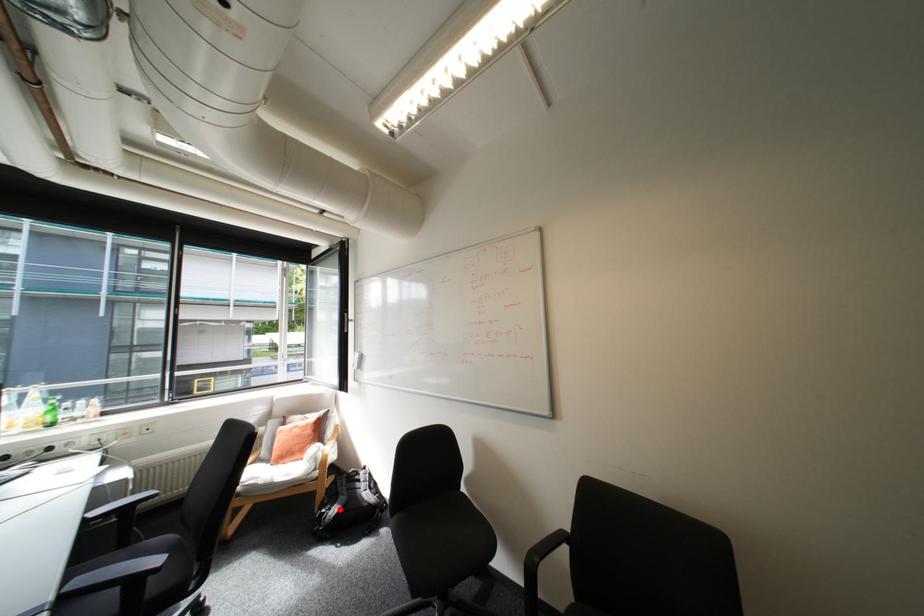
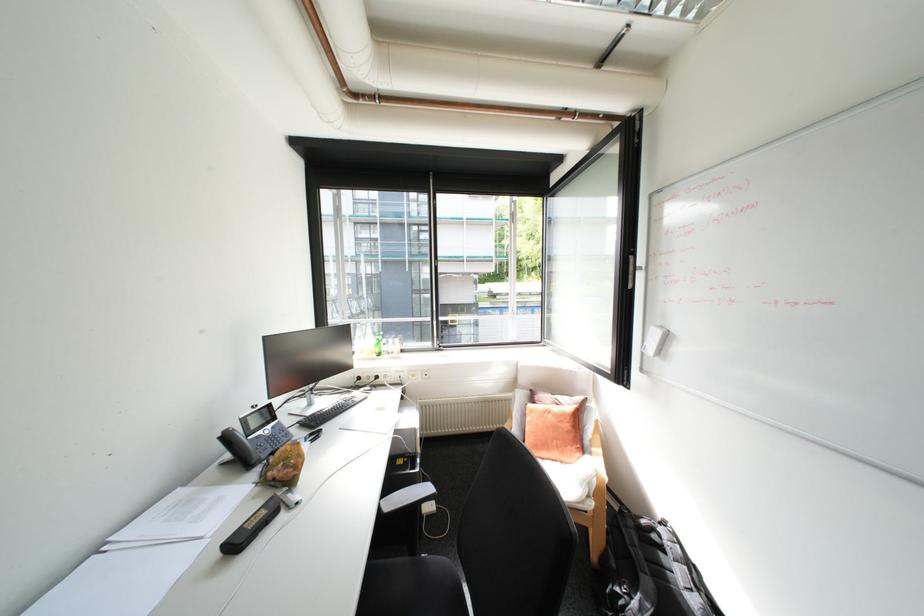
Find the pixel in the second image that matches the highlighted location in the first image.

(640, 598)